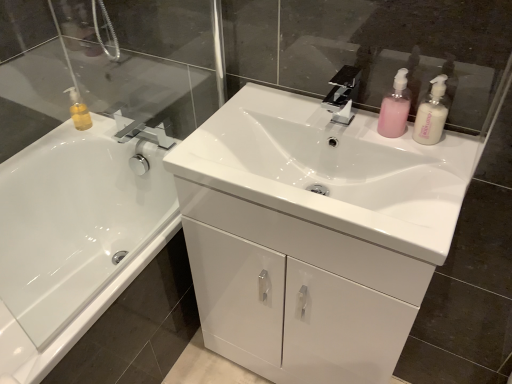
Locate an element on the screen. The height and width of the screenshot is (384, 512). unoccupied region to the right of black glossy faucet at center is located at coordinates (398, 136).